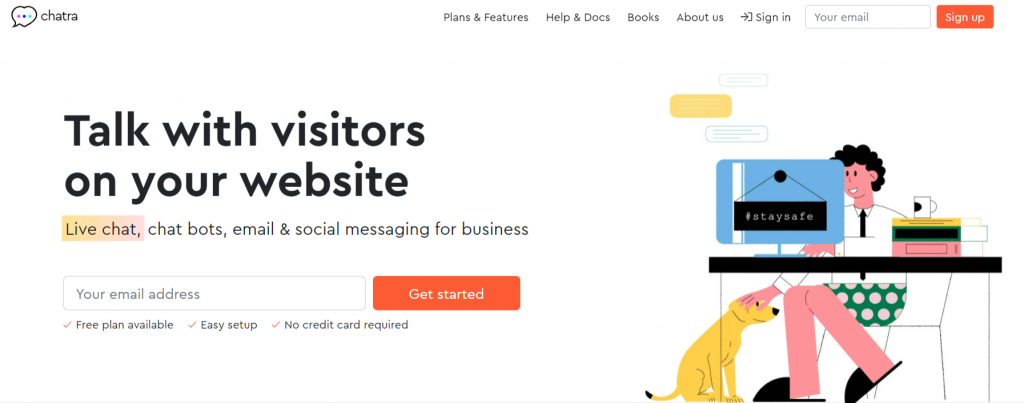
The image size is (1024, 403). Find the location of `table`. table is located at coordinates (780, 265).